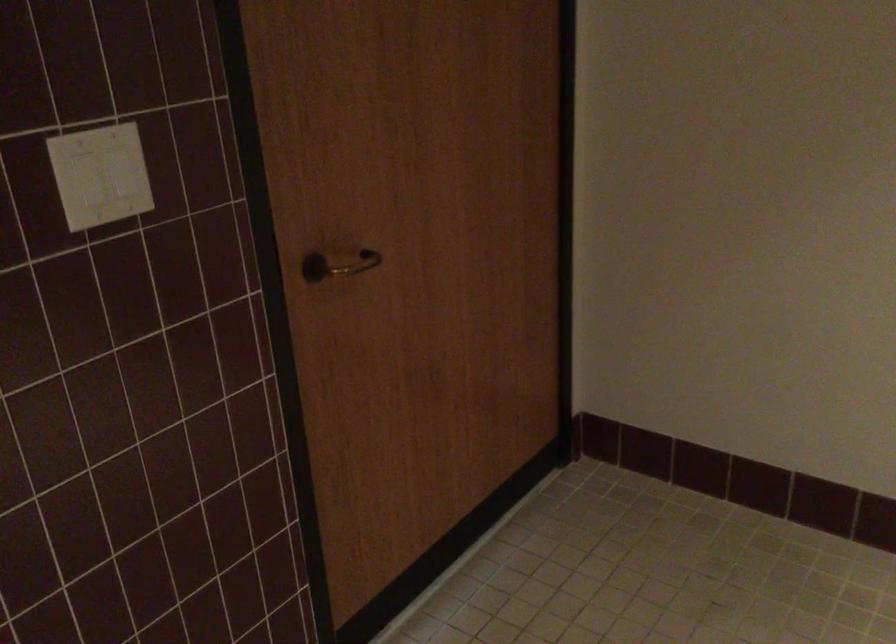
What do you see at coordinates (338, 265) in the screenshot? This screenshot has height=644, width=896. I see `the door handle` at bounding box center [338, 265].